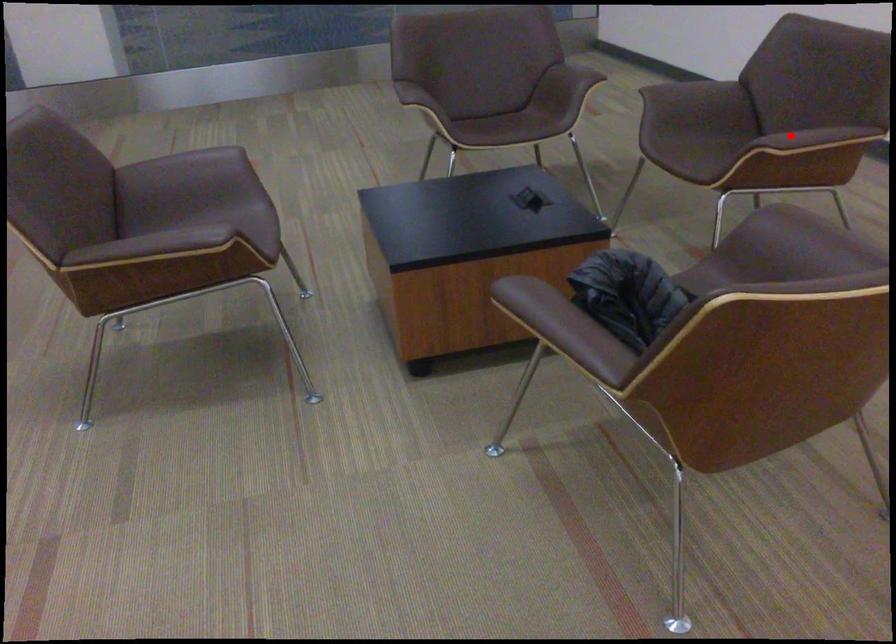
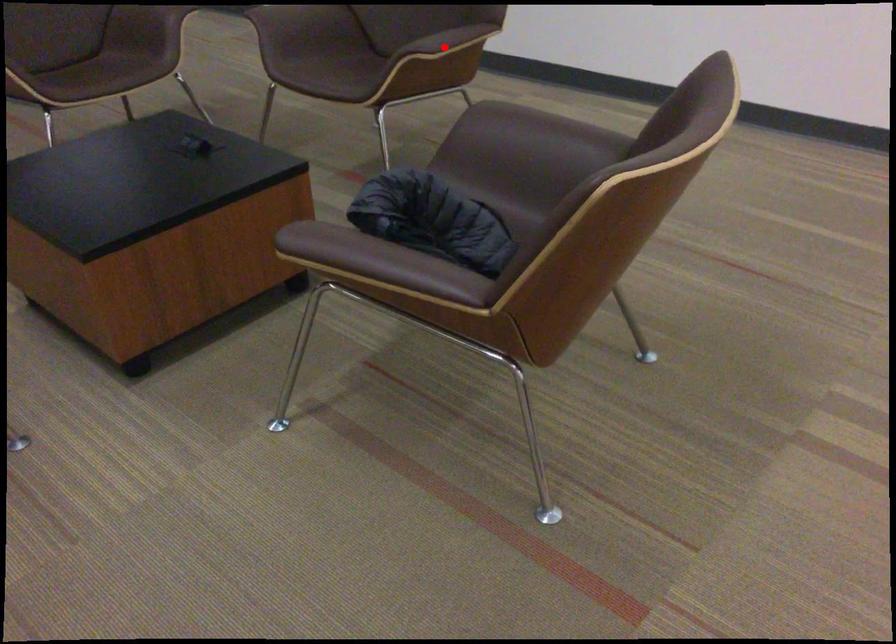
I am providing you with two images of the same scene from different viewpoints. A red point is marked on the first image and another point is marked on the second image. Is the marked point in image1 the same physical position as the marked point in image2?

Yes